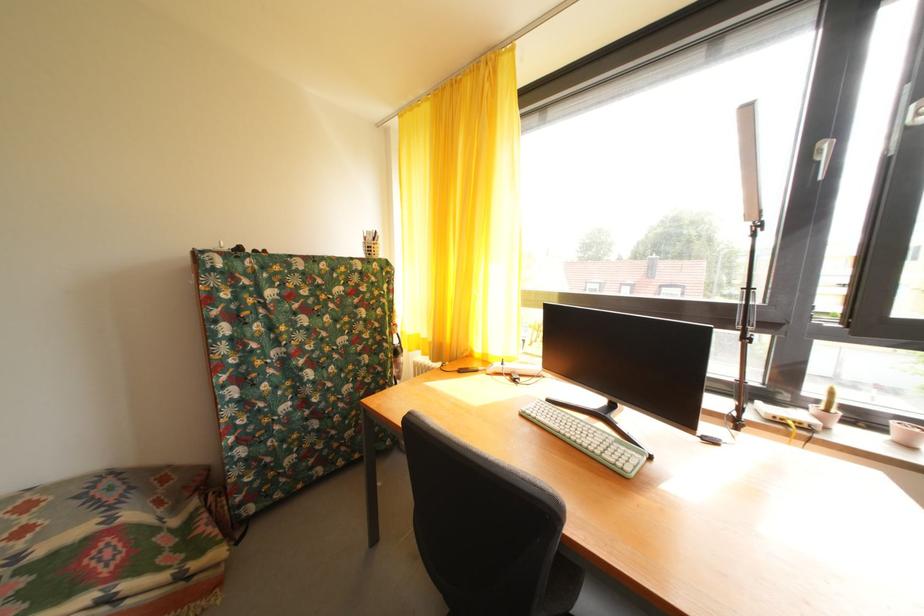
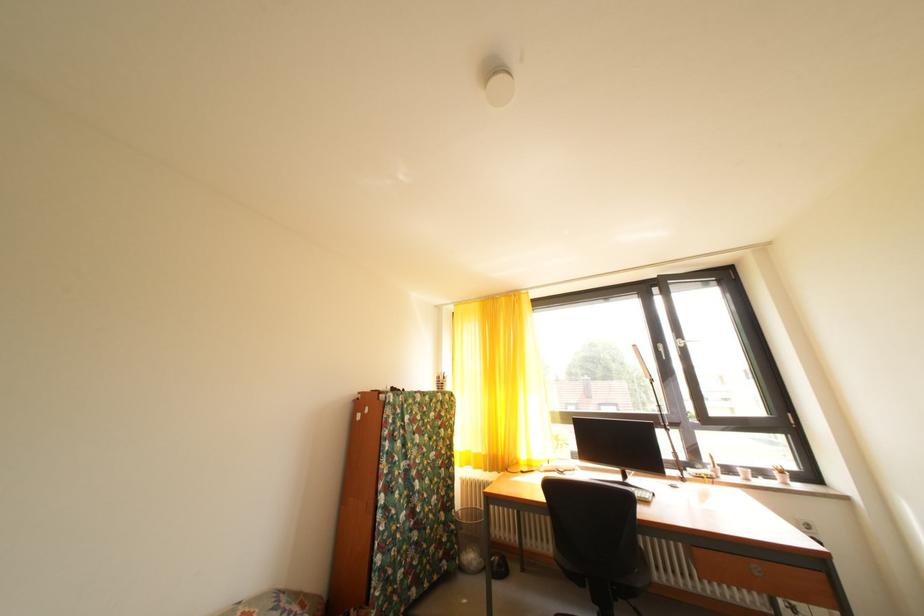
The images are taken continuously from a first-person perspective. In which direction are you moving?

The movement direction of the cameraman is left, backward.